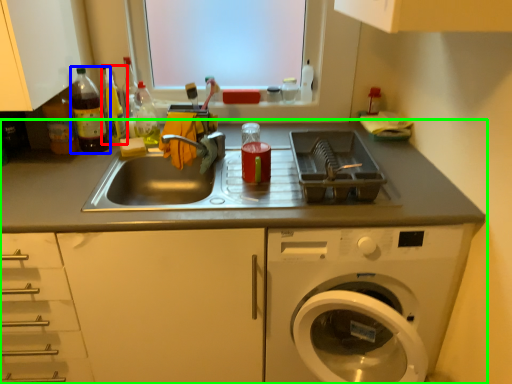
Question: Which is farther away from bottle (highlighted by a red box)? bottle (highlighted by a blue box) or countertop (highlighted by a green box)?

Choices:
 (A) bottle
 (B) countertop

Answer: (B)